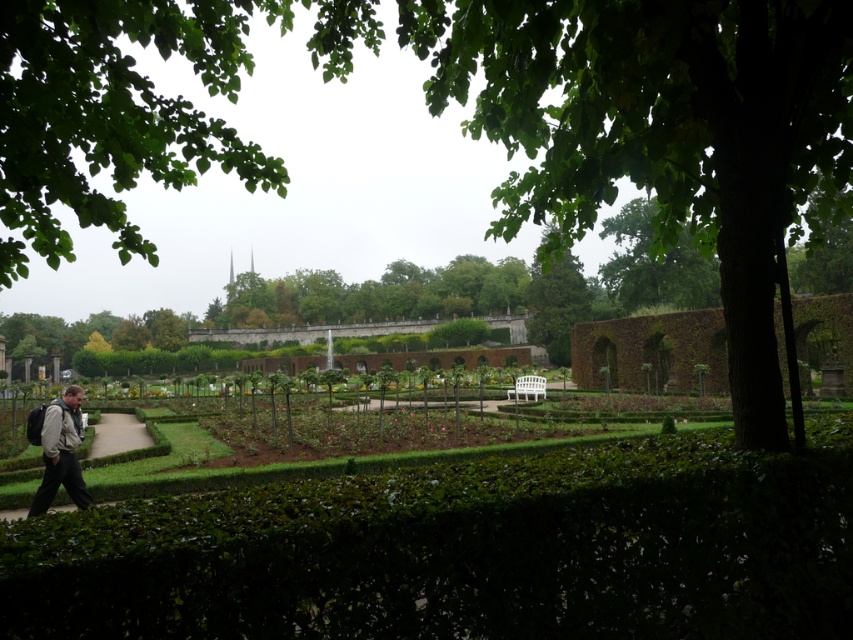
You are standing at the light brown leather jacket at lower left and want to walk to the green leafy tree at center. Given that the garden has a 100 feet wide path, will you be able to reach the tree without leaving the path?

The green leafy tree at center is 222.47 feet from the light brown leather jacket at lower left. Since the garden path is only 100 feet wide, you would need to walk beyond the path to reach the tree, so you cannot reach it without leaving the path.

Consider the image. You are standing in the garden and want to take a photo of the green leafy tree at center. Where should you position yourself to ensure the tree is centered in your camera viewfinder?

To center the green leafy tree at center in your camera viewfinder, position yourself directly in front of the tree at the coordinates specified by its position point, which is at point (556,305).